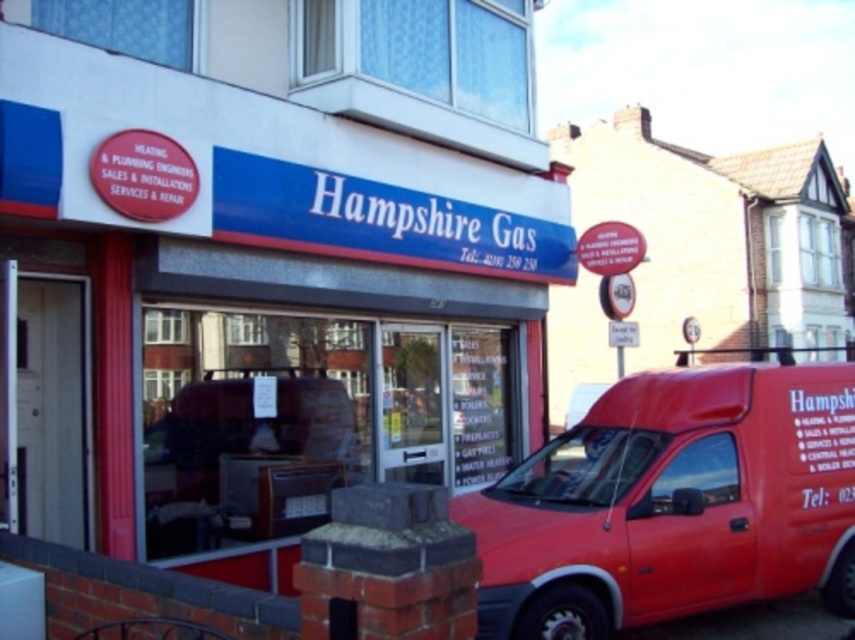
Which is below, matte blue signboard at center or metallic red van at center?

metallic red van at center is below.

Can you confirm if matte blue signboard at center is positioned to the left of metallic red van at center?

Yes, matte blue signboard at center is to the left of metallic red van at center.

At what (x,y) coordinates should I click in order to perform the action: click on matte blue signboard at center. Please return your answer as a coordinate pair (x, y). This screenshot has width=855, height=640. Looking at the image, I should click on (264, 262).

What are the coordinates of `matte blue signboard at center` in the screenshot? It's located at (264, 262).